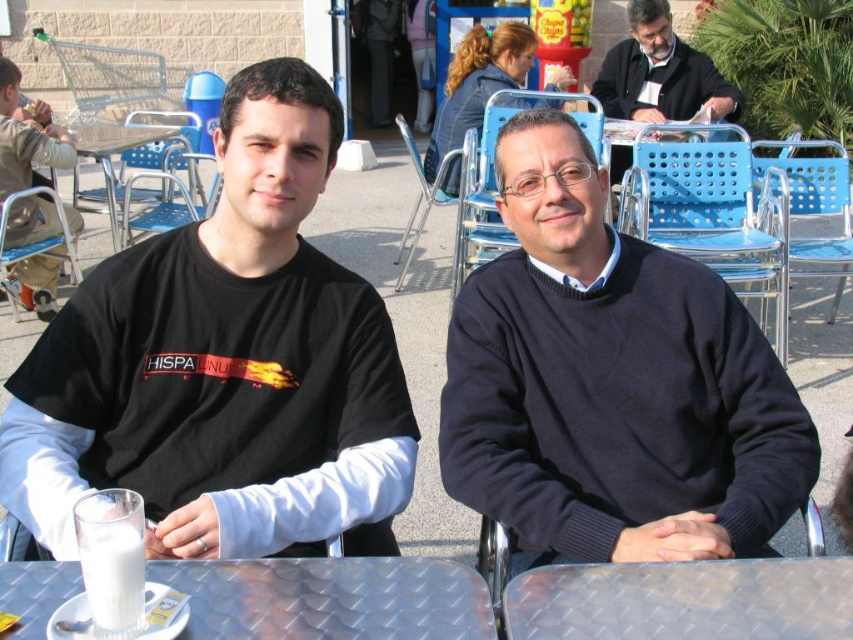
Which of these two, metallic diamond plate table at center or dark blue sweater at upper right, stands taller?

Standing taller between the two is dark blue sweater at upper right.

Does metallic diamond plate table at center appear under dark blue sweater at upper right?

Yes, metallic diamond plate table at center is below dark blue sweater at upper right.

Who is more distant from viewer, [755,618] or [627,154]?

The point [627,154] is behind.

Find the location of a particular element. The width and height of the screenshot is (853, 640). metallic diamond plate table at center is located at coordinates (683, 600).

Does metallic diamond plate table at center have a larger size compared to khaki cotton pants at lower left?

Actually, metallic diamond plate table at center might be smaller than khaki cotton pants at lower left.

Who is shorter, metallic diamond plate table at center or khaki cotton pants at lower left?

metallic diamond plate table at center

Between point (663, 595) and point (12, 193), which one is positioned behind?

The point (12, 193) is more distant.

You are a GUI agent. You are given a task and a screenshot of the screen. Output one action in this format:
    pyautogui.click(x=<x>, y=<y>)
    Task: Click on the metallic diamond plate table at center
    
    Given the screenshot: What is the action you would take?
    pyautogui.click(x=683, y=600)

Who is more distant from viewer, (172,394) or (624,115)?

Point (624,115)

Is the position of black matte t-shirt at left more distant than that of dark blue sweater at upper right?

No.

Which is behind, point (96, 321) or point (669, 72)?

The point (669, 72) is behind.

Where is `black matte t-shirt at left`? black matte t-shirt at left is located at coordinates point(224,365).